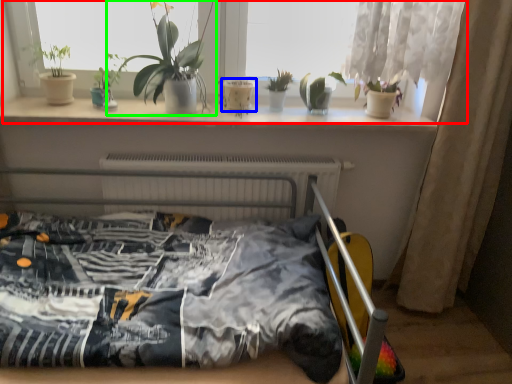
Question: Based on their relative distances, which object is farther from window (highlighted by a red box)? Choose from flowerpot (highlighted by a blue box) and houseplant (highlighted by a green box).

Choices:
 (A) flowerpot
 (B) houseplant

Answer: (A)